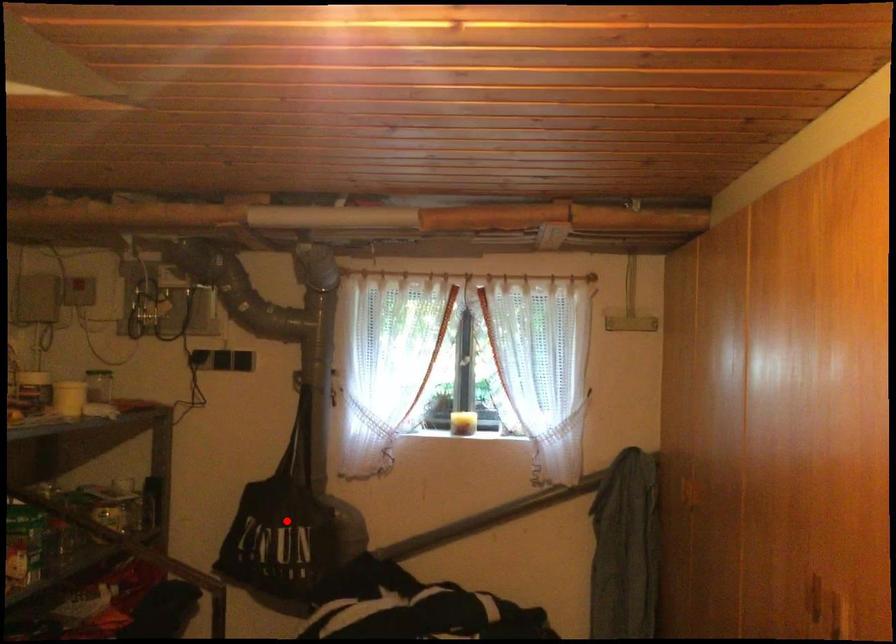
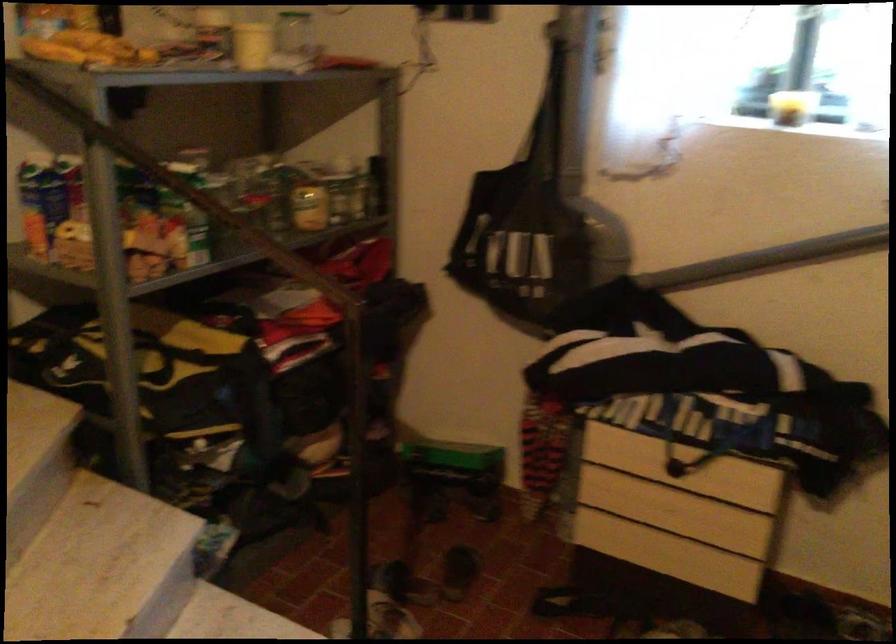
Find the pixel in the second image that matches the highlighted location in the first image.

(526, 223)